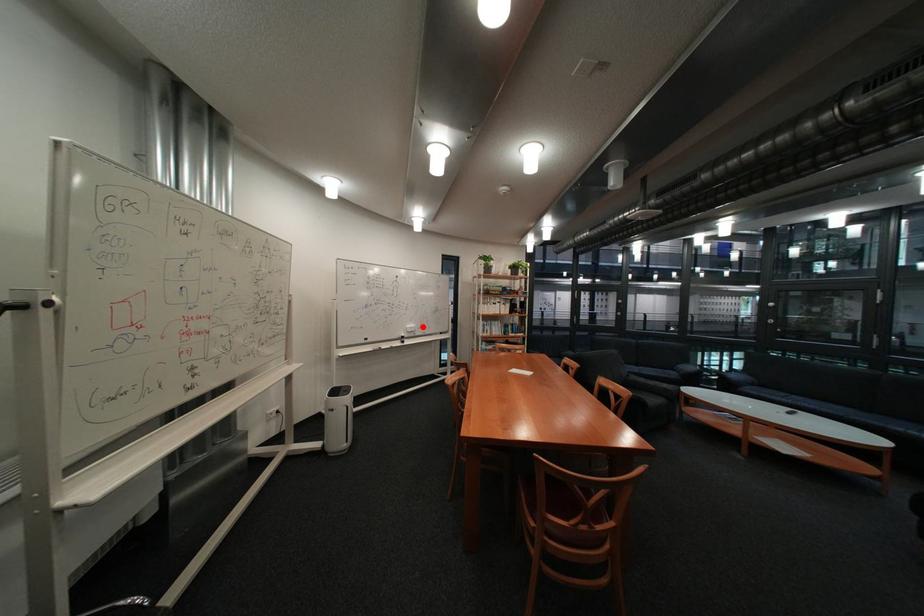
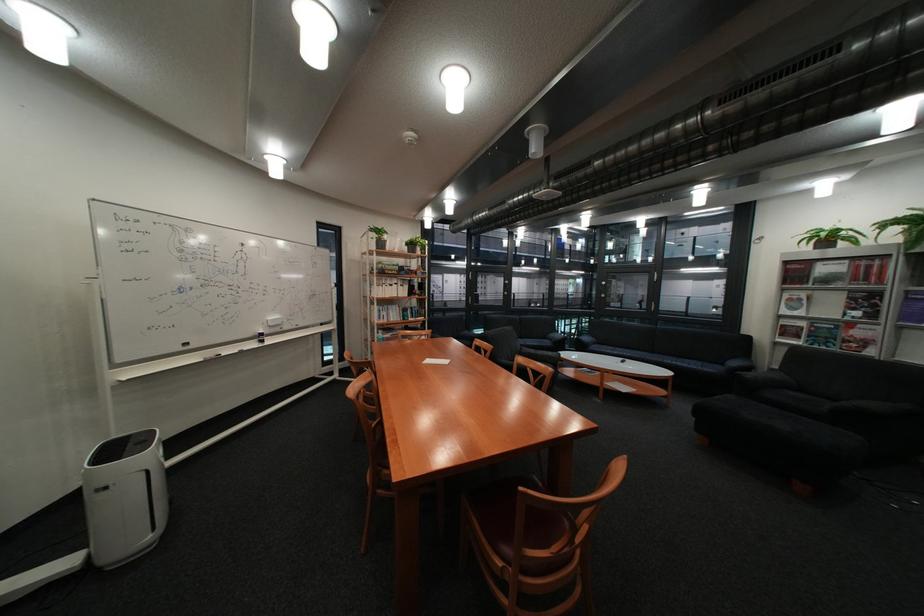
Question: I am providing you with two images of the same scene from different viewpoints. In image1, a red point is highlighted. Considering the same 3D point in image2, which of the following is correct?

Choices:
 (A) It is closer
 (B) It is farther

Answer: (A)